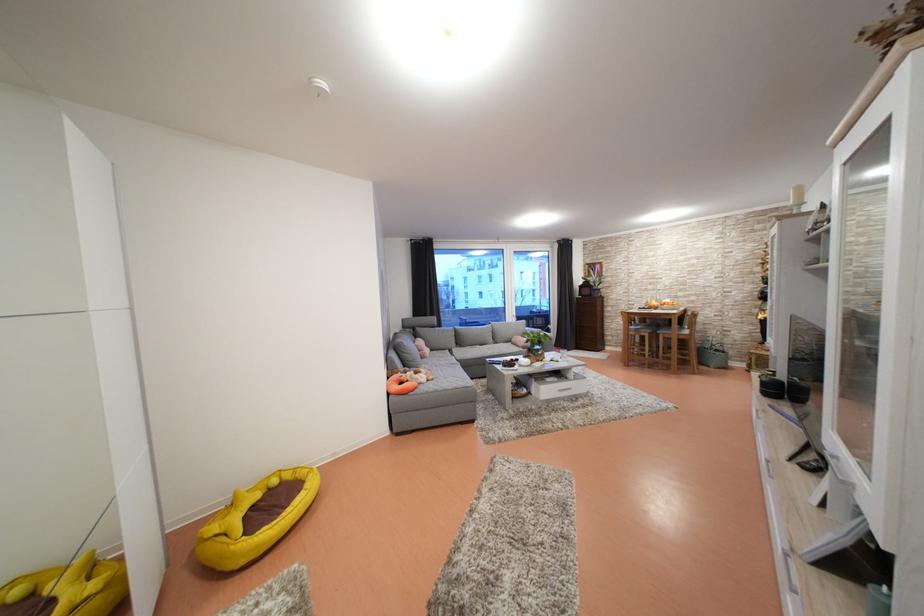
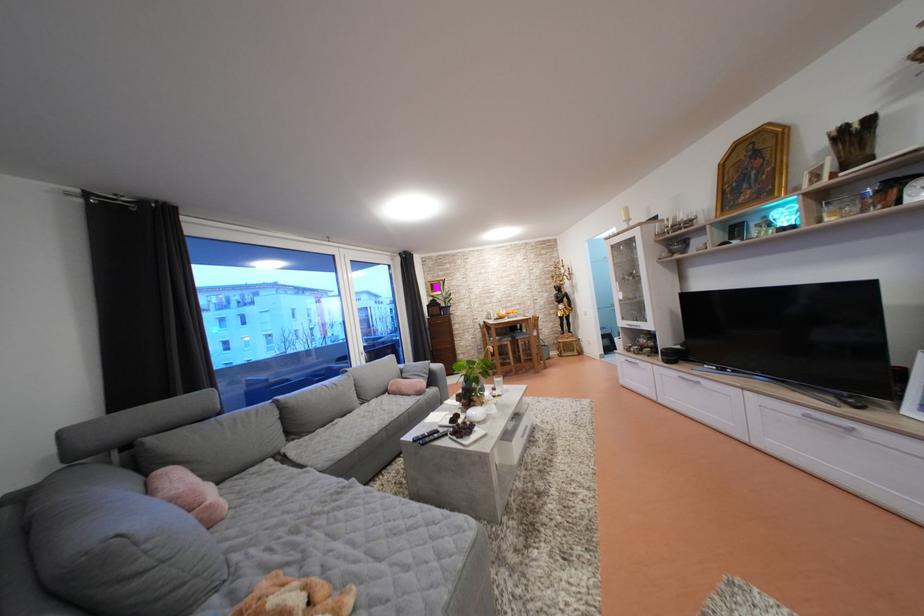
Locate, in the second image, the point that corresponds to (x=619, y=341) in the first image.

(470, 359)